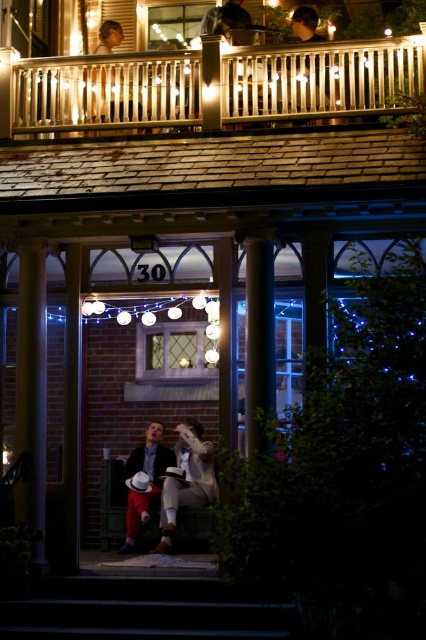
Can you confirm if smooth concrete stairs at lower center is shorter than matte black hair at upper center?

Indeed, smooth concrete stairs at lower center has a lesser height compared to matte black hair at upper center.

Where is `smooth concrete stairs at lower center`? Image resolution: width=426 pixels, height=640 pixels. smooth concrete stairs at lower center is located at coordinates (x=141, y=611).

Where is `smooth concrete stairs at lower center`? Image resolution: width=426 pixels, height=640 pixels. smooth concrete stairs at lower center is located at coordinates (141, 611).

Does metallic silver railing at upper center appear over white cotton shirt at center?

Yes.

Which is in front, point (377, 61) or point (147, 499)?

Point (377, 61) is more forward.

Identify the location of metallic silver railing at upper center. pos(316,77).

The width and height of the screenshot is (426, 640). What do you see at coordinates (316, 77) in the screenshot?
I see `metallic silver railing at upper center` at bounding box center [316, 77].

Is point (386, 88) positioned after point (101, 602)?

Yes, it is behind point (101, 602).

Is point (97, 124) farther from viewer compared to point (108, 608)?

Yes.

I want to click on metallic silver railing at upper center, so click(x=316, y=77).